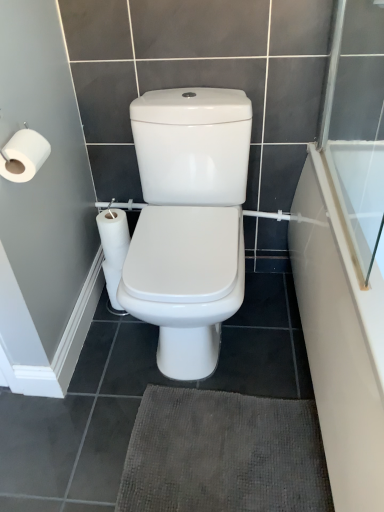
Question: Does dark gray textured bath mat at lower center have a lesser width compared to white matte toilet paper at left?

Choices:
 (A) no
 (B) yes

Answer: (A)

Question: From the image's perspective, is dark gray textured bath mat at lower center beneath white matte toilet paper at left?

Choices:
 (A) yes
 (B) no

Answer: (A)

Question: Does dark gray textured bath mat at lower center have a greater height compared to white matte toilet paper at left?

Choices:
 (A) yes
 (B) no

Answer: (B)

Question: From a real-world perspective, is dark gray textured bath mat at lower center under white matte toilet paper at left?

Choices:
 (A) yes
 (B) no

Answer: (A)

Question: Considering the relative positions of dark gray textured bath mat at lower center and white matte toilet paper at left in the image provided, is dark gray textured bath mat at lower center in front of white matte toilet paper at left?

Choices:
 (A) no
 (B) yes

Answer: (A)

Question: Is dark gray textured bath mat at lower center aimed at white matte toilet paper at left?

Choices:
 (A) no
 (B) yes

Answer: (A)

Question: Is dark gray textured bath mat at lower center not near transparent glass screen door at upper right?

Choices:
 (A) no
 (B) yes

Answer: (A)

Question: Considering the relative sizes of dark gray textured bath mat at lower center and transparent glass screen door at upper right in the image provided, is dark gray textured bath mat at lower center thinner than transparent glass screen door at upper right?

Choices:
 (A) no
 (B) yes

Answer: (A)

Question: Considering the relative sizes of dark gray textured bath mat at lower center and transparent glass screen door at upper right in the image provided, is dark gray textured bath mat at lower center smaller than transparent glass screen door at upper right?

Choices:
 (A) no
 (B) yes

Answer: (B)

Question: Are dark gray textured bath mat at lower center and transparent glass screen door at upper right making contact?

Choices:
 (A) yes
 (B) no

Answer: (B)

Question: Is dark gray textured bath mat at lower center aimed at transparent glass screen door at upper right?

Choices:
 (A) yes
 (B) no

Answer: (B)

Question: Is dark gray textured bath mat at lower center wider than transparent glass screen door at upper right?

Choices:
 (A) no
 (B) yes

Answer: (B)

Question: Is white glossy bathtub at right not close to white matte toilet paper at left?

Choices:
 (A) yes
 (B) no

Answer: (B)